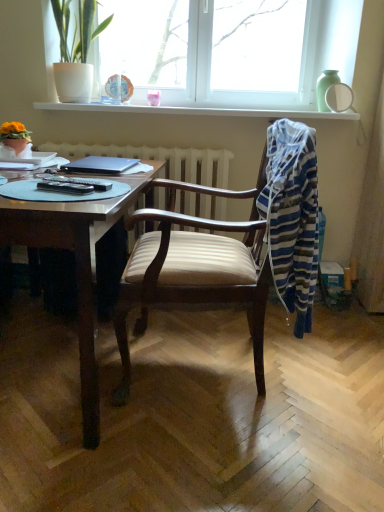
Question: In terms of width, does white glossy window sill at upper center look wider or thinner when compared to striped cotton laundry at right?

Choices:
 (A) thin
 (B) wide

Answer: (B)

Question: Is white glossy window sill at upper center in front of or behind striped cotton laundry at right in the image?

Choices:
 (A) front
 (B) behind

Answer: (B)

Question: Considering the real-world distances, which object is closest to the wooden desk at left?

Choices:
 (A) wooden chair at center
 (B) white matte pot at upper left, the second houseplant in the front-to-back sequence
 (C) striped cotton laundry at right
 (D) matte orange flower pot at left, which ranks as the 2th houseplant in right-to-left order
 (E) white glossy window sill at upper center

Answer: (A)

Question: Estimate the real-world distances between objects in this image. Which object is farther from the matte orange flower pot at left, which is the 2th houseplant from top to bottom?

Choices:
 (A) wooden desk at left
 (B) white matte pot at upper left, the second houseplant positioned from the bottom
 (C) striped cotton laundry at right
 (D) wooden chair at center
 (E) white plastic window at upper center

Answer: (E)